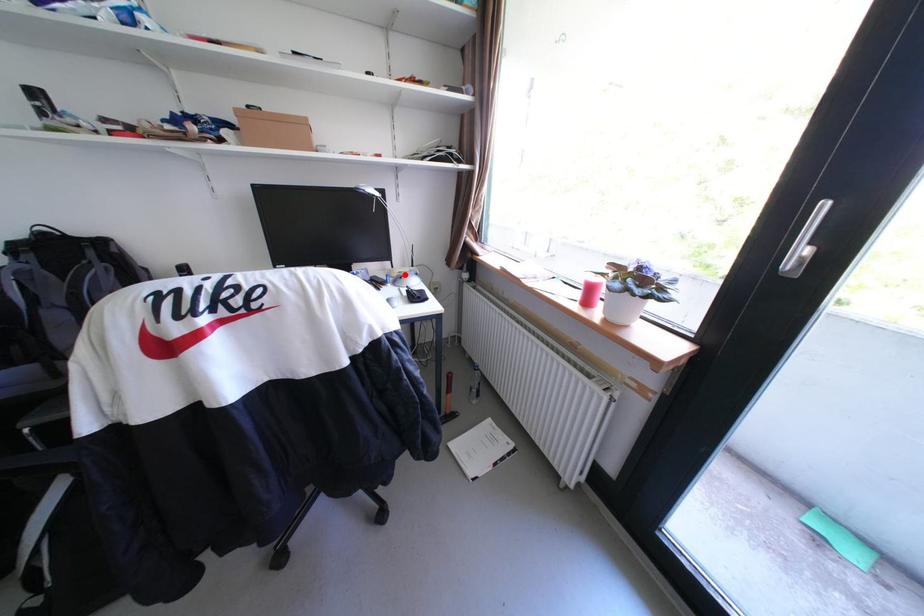
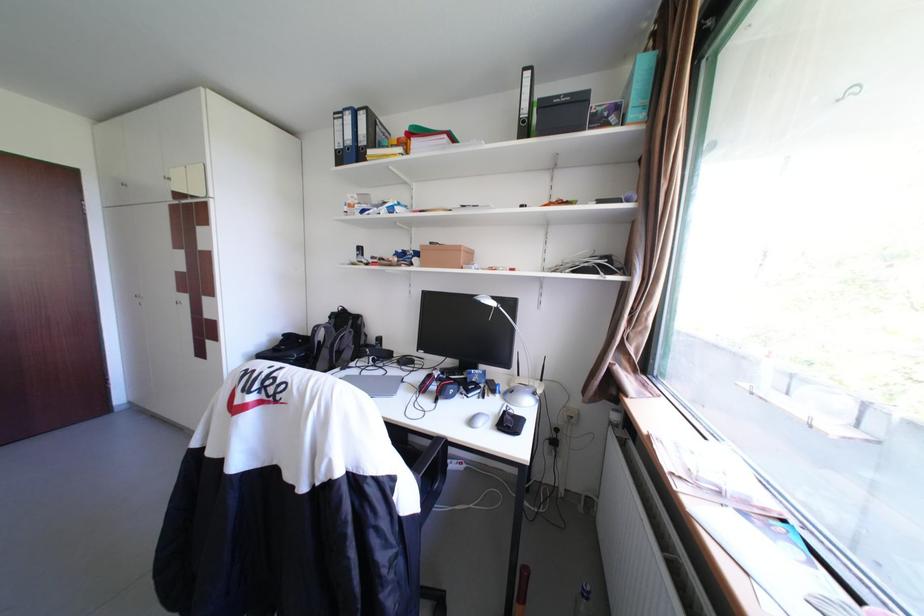
Question: A red point is marked in image1. In image2, is the corresponding 3D point closer to the camera or farther? Reply with the corresponding letter.

Choices:
 (A) The corresponding 3D point is closer.
 (B) The corresponding 3D point is farther.

Answer: (B)